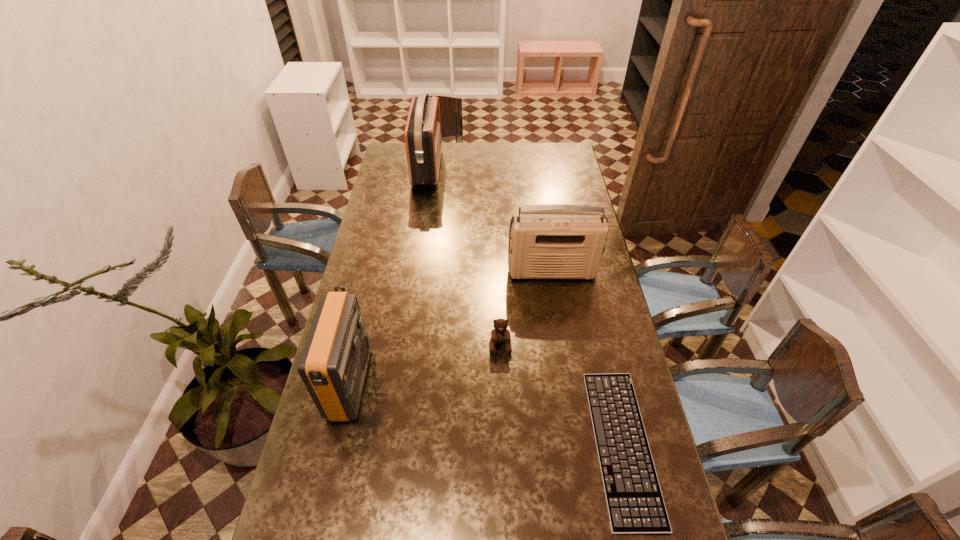
This screenshot has height=540, width=960. In order to click on the second radio receiver from left to right in this screenshot , I will do `click(423, 141)`.

At what (x,y) coordinates should I click in order to perform the action: click on the farthest object. Please return your answer as a coordinate pair (x, y). The width and height of the screenshot is (960, 540). Looking at the image, I should click on (423, 141).

This screenshot has width=960, height=540. I want to click on the fourth nearest object, so click(x=550, y=241).

This screenshot has width=960, height=540. In order to click on the rightmost radio receiver in this screenshot , I will do point(550,241).

Identify the location of the nearest radio receiver. point(333,365).

In order to click on the leftmost radio receiver in this screenshot , I will do `click(333, 365)`.

What are the coordinates of `teddy bear` in the screenshot? It's located at (500, 334).

Where is `the third object from right to left`? The image size is (960, 540). the third object from right to left is located at coordinates (500, 334).

The width and height of the screenshot is (960, 540). I want to click on the shortest object, so click(x=635, y=504).

Where is `free space located on the front-facing side of the fourth object from right to left`? free space located on the front-facing side of the fourth object from right to left is located at coordinates (486, 167).